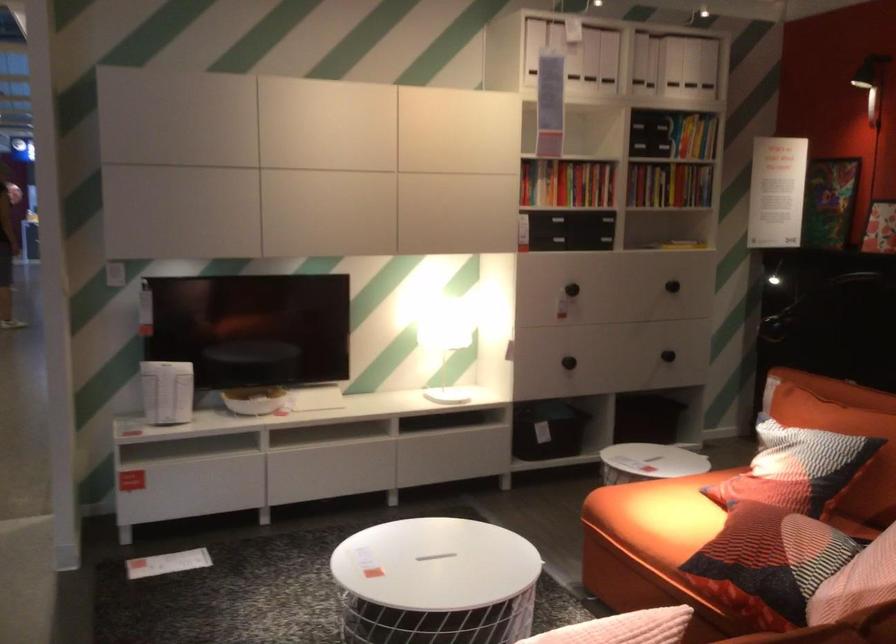
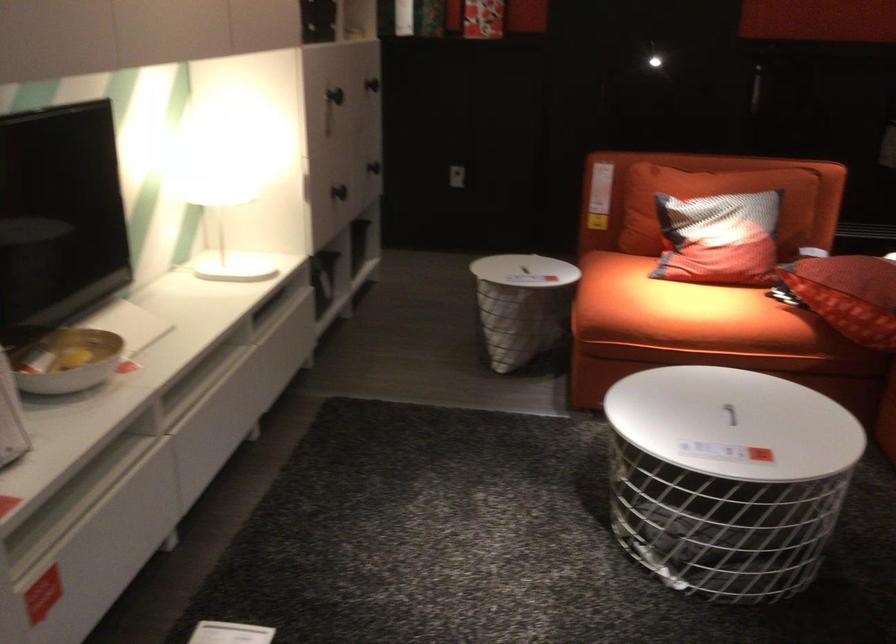
Where in the second image is the point corresponding to the point at 653,521 from the first image?

(684, 312)